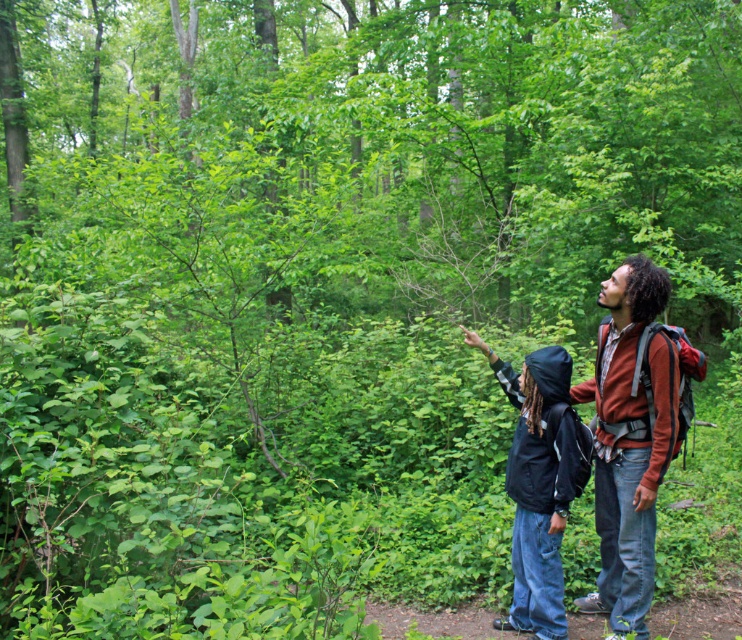
Between point (643, 476) and point (522, 515), which one is positioned in front?

Point (643, 476)

Does brown cotton shirt at right appear under black jacket at right?

Incorrect, brown cotton shirt at right is not positioned below black jacket at right.

Between point (614, 467) and point (536, 380), which one is positioned in front?

Point (614, 467) is more forward.

In order to click on brown cotton shirt at right in this screenshot , I will do `click(628, 440)`.